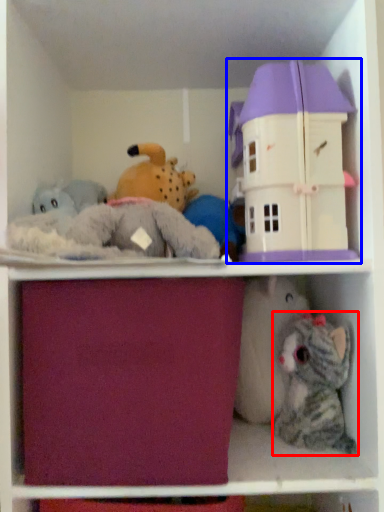
Question: Which of the following is the farthest to the observer, toy (highlighted by a red box) or toy (highlighted by a blue box)?

Choices:
 (A) toy
 (B) toy

Answer: (A)